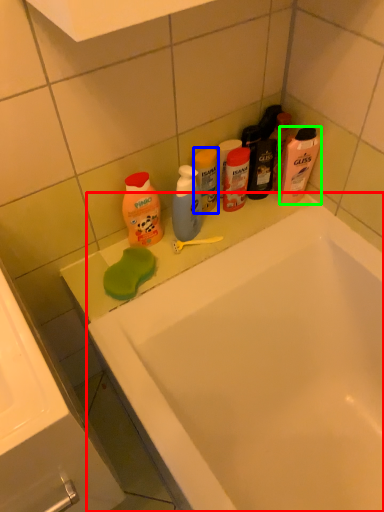
Question: Which object is the farthest from bathtub (highlighted by a red box)? Choose among these: cleaning product (highlighted by a blue box) or cleaning product (highlighted by a green box).

Choices:
 (A) cleaning product
 (B) cleaning product

Answer: (A)